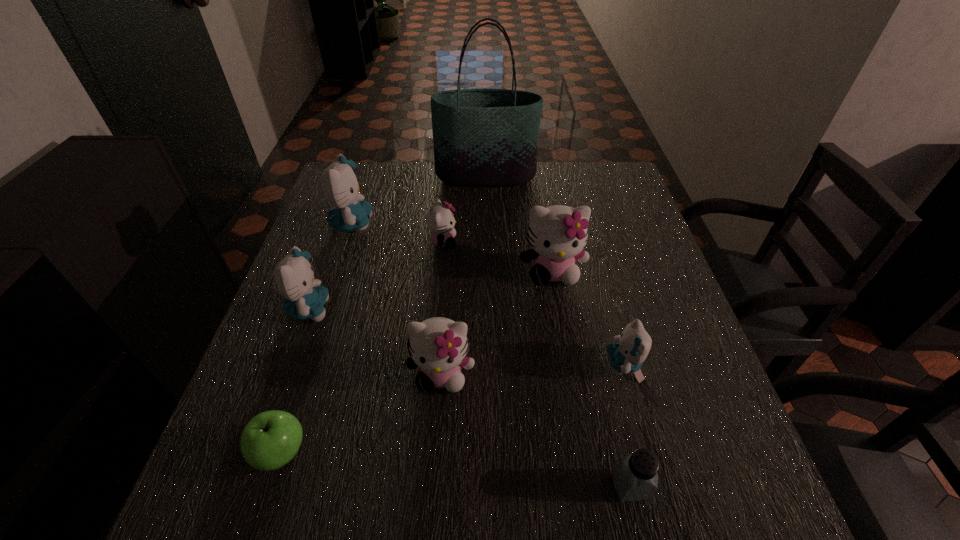
This screenshot has height=540, width=960. Identify the location of the tallest object. (483, 137).

Identify the location of the farthest object. Image resolution: width=960 pixels, height=540 pixels. (483, 137).

At what (x,y) coordinates should I click in order to perform the action: click on the biggest blue kitten. Please return your answer as a coordinate pair (x, y). Looking at the image, I should click on (339, 184).

The image size is (960, 540). Identify the location of the rightmost white kitten. (558, 234).

This screenshot has width=960, height=540. What are the coordinates of `the second nearest white kitten` in the screenshot? It's located at (558, 234).

What are the coordinates of `the second nearest blue kitten` in the screenshot? It's located at (305, 298).

Locate an element on the screen. The height and width of the screenshot is (540, 960). the nearest white kitten is located at coordinates (439, 346).

Locate an element on the screen. The width and height of the screenshot is (960, 540). the farthest white kitten is located at coordinates [x=440, y=220].

At what (x,y) coordinates should I click in order to perform the action: click on the rightmost blue kitten. Please return your answer as a coordinate pair (x, y). This screenshot has height=540, width=960. Looking at the image, I should click on (629, 351).

Find the location of a particular element. This screenshot has height=540, width=960. the smallest blue kitten is located at coordinates (629, 351).